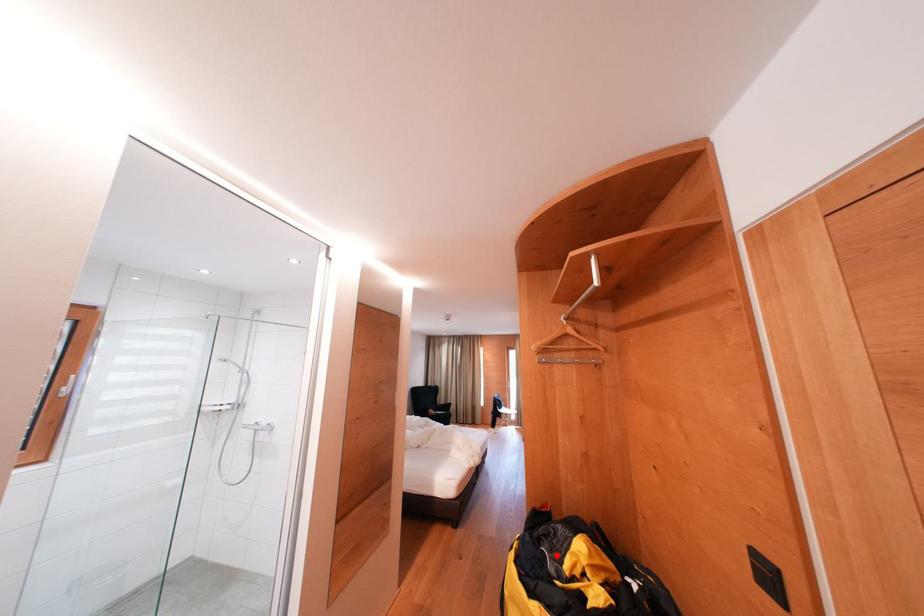
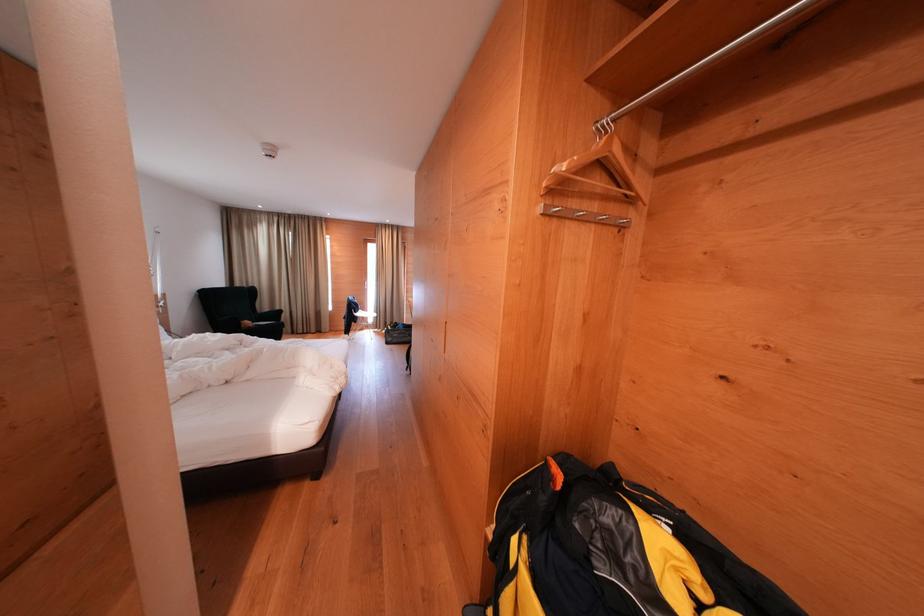
Where in the second image is the point corresponding to the highlighted location from the first image?

(635, 584)